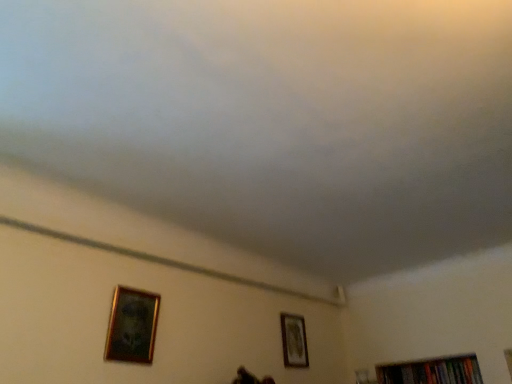
Question: From the image's perspective, is gold-framed picture at lower left, arranged as the first picture frame when viewed from the left, beneath gold-framed picture at lower right, the first picture frame positioned from the back?

Choices:
 (A) yes
 (B) no

Answer: (B)

Question: From the image's perspective, would you say gold-framed picture at lower left, which is counted as the second picture frame, starting from the back, is positioned over gold-framed picture at lower right, which is the second picture frame in front-to-back order?

Choices:
 (A) yes
 (B) no

Answer: (A)

Question: Is gold-framed picture at lower left, which appears as the second picture frame when viewed from the right, positioned with its back to gold-framed picture at lower right, which is the 2th picture frame in top-to-bottom order?

Choices:
 (A) yes
 (B) no

Answer: (B)

Question: Is gold-framed picture at lower left, which is counted as the 1th picture frame, starting from the top, outside gold-framed picture at lower right, which is the 2th picture frame in top-to-bottom order?

Choices:
 (A) yes
 (B) no

Answer: (A)

Question: Considering the relative sizes of gold-framed picture at lower left, which is counted as the 1th picture frame, starting from the top, and gold-framed picture at lower right, which is the second picture frame in front-to-back order, in the image provided, is gold-framed picture at lower left, which is counted as the 1th picture frame, starting from the top, shorter than gold-framed picture at lower right, which is the second picture frame in front-to-back order,?

Choices:
 (A) no
 (B) yes

Answer: (B)

Question: Considering the positions of gold-framed picture at lower left, which appears as the second picture frame when viewed from the right, and gold-framed picture at lower right, the first picture frame positioned from the back, in the image, is gold-framed picture at lower left, which appears as the second picture frame when viewed from the right, bigger or smaller than gold-framed picture at lower right, the first picture frame positioned from the back,?

Choices:
 (A) big
 (B) small

Answer: (A)

Question: Visually, is gold-framed picture at lower left, which ranks as the second picture frame in bottom-to-top order, positioned to the left or to the right of gold-framed picture at lower right, which is the second picture frame in front-to-back order?

Choices:
 (A) right
 (B) left

Answer: (B)

Question: Which is correct: gold-framed picture at lower left, arranged as the first picture frame when viewed from the left, is inside gold-framed picture at lower right, positioned as the 1th picture frame in right-to-left order, or outside of it?

Choices:
 (A) outside
 (B) inside

Answer: (A)

Question: Considering their positions, is gold-framed picture at lower left, which is the 1th picture frame from front to back, located in front of or behind gold-framed picture at lower right, positioned as the 1th picture frame in right-to-left order?

Choices:
 (A) behind
 (B) front

Answer: (B)

Question: In terms of size, does gold-framed picture at lower right, which is counted as the second picture frame, starting from the left, appear bigger or smaller than hardcover books at bottom right?

Choices:
 (A) big
 (B) small

Answer: (B)

Question: From a real-world perspective, is gold-framed picture at lower right, positioned as the 1th picture frame in right-to-left order, above or below hardcover books at bottom right?

Choices:
 (A) below
 (B) above

Answer: (B)

Question: Considering their positions, is gold-framed picture at lower right, which is the second picture frame in front-to-back order, located in front of or behind hardcover books at bottom right?

Choices:
 (A) behind
 (B) front

Answer: (B)

Question: From the image's perspective, is gold-framed picture at lower right, acting as the 1th picture frame starting from the bottom, above or below hardcover books at bottom right?

Choices:
 (A) below
 (B) above

Answer: (B)

Question: Visually, is hardcover books at bottom right positioned to the left or to the right of gold-framed picture at lower left, which is counted as the second picture frame, starting from the back?

Choices:
 (A) right
 (B) left

Answer: (A)

Question: Relative to gold-framed picture at lower left, which is the 1th picture frame from front to back, is hardcover books at bottom right in front or behind?

Choices:
 (A) behind
 (B) front

Answer: (A)